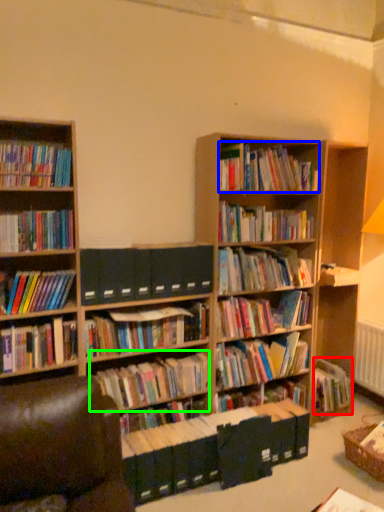
Question: Estimate the real-world distances between objects in this image. Which object is farther from book (highlighted by a red box), book (highlighted by a blue box) or book (highlighted by a green box)?

Choices:
 (A) book
 (B) book

Answer: (A)